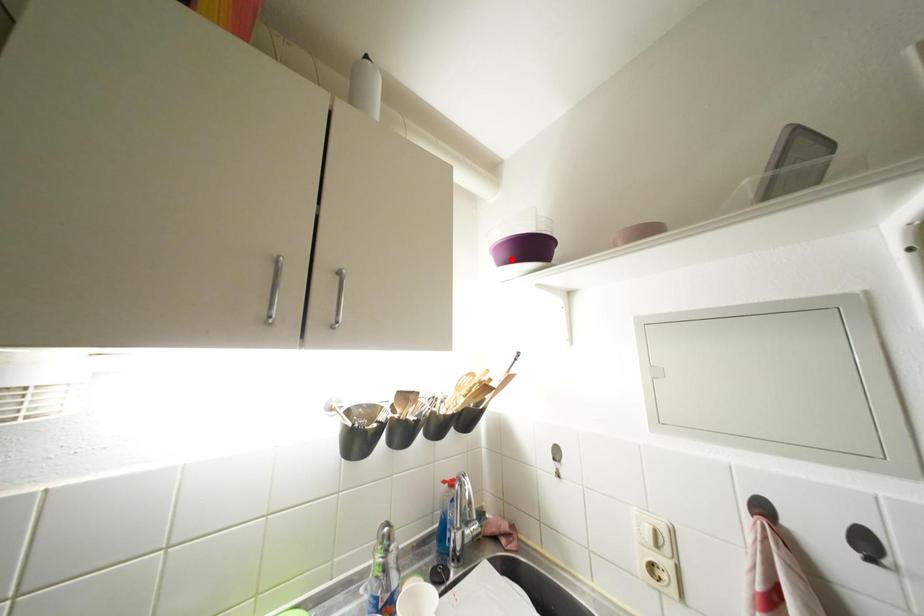
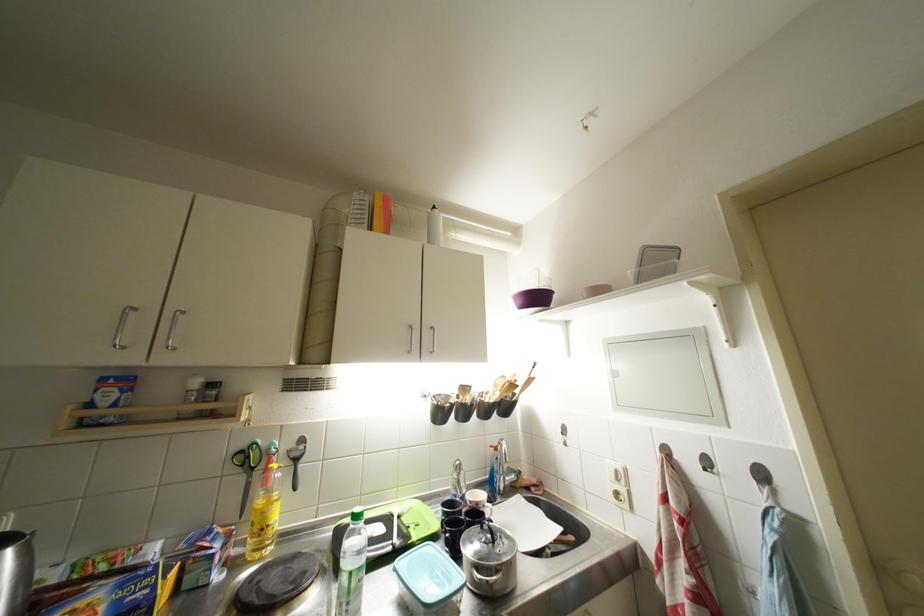
Find the pixel in the second image that matches the highlighted location in the first image.

(527, 306)